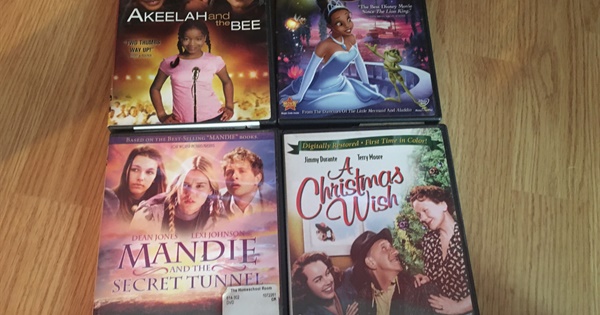
Where is `dvds`? The width and height of the screenshot is (600, 315). dvds is located at coordinates (192, 25), (328, 42), (342, 166), (190, 173).